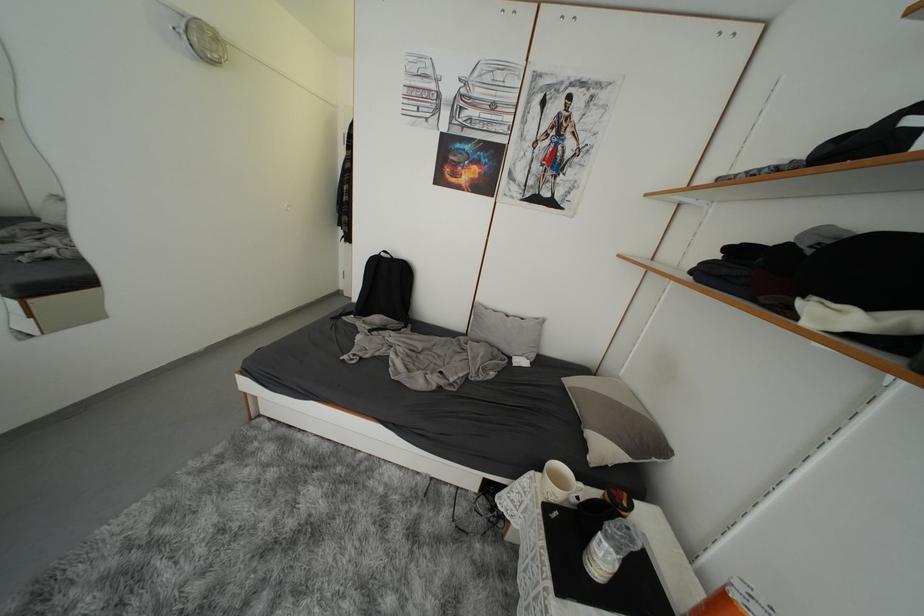
You are a GUI agent. You are given a task and a screenshot of the screen. Output one action in this format:
    pyautogui.click(x=<x>, y=<y>)
    Task: Click on the cabinet door cutout
    The width and height of the screenshot is (924, 616).
    Given the screenshot: What is the action you would take?
    pyautogui.click(x=55, y=312)